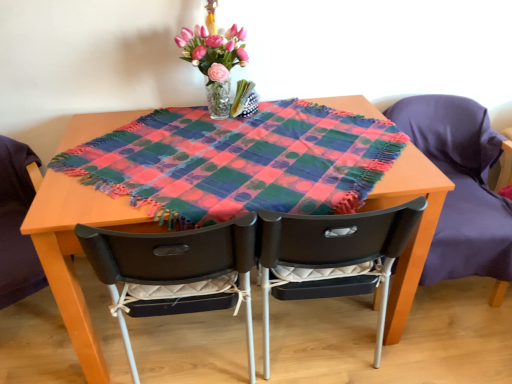
Question: Would you say matte black chair at center, the third chair viewed from the right, contains wooden table at center?

Choices:
 (A) no
 (B) yes

Answer: (A)

Question: Are matte black chair at center, the 1th chair viewed from the left, and wooden table at center beside each other?

Choices:
 (A) no
 (B) yes

Answer: (A)

Question: Considering the relative sizes of matte black chair at center, the 1th chair viewed from the left, and wooden table at center in the image provided, is matte black chair at center, the 1th chair viewed from the left, bigger than wooden table at center?

Choices:
 (A) yes
 (B) no

Answer: (A)

Question: Considering the relative positions of matte black chair at center, the third chair viewed from the right, and wooden table at center in the image provided, is matte black chair at center, the third chair viewed from the right, to the left of wooden table at center from the viewer's perspective?

Choices:
 (A) no
 (B) yes

Answer: (B)

Question: Is matte black chair at center, the third chair viewed from the right, taller than wooden table at center?

Choices:
 (A) no
 (B) yes

Answer: (B)

Question: Can you confirm if matte black chair at center, the 1th chair viewed from the left, is wider than wooden table at center?

Choices:
 (A) no
 (B) yes

Answer: (A)

Question: From the image's perspective, is matte black chair at right, which is the first chair from right to left, beneath matte black chair at center, the third chair viewed from the right?

Choices:
 (A) no
 (B) yes

Answer: (A)

Question: Is matte black chair at right, which is the 3th chair in left-to-right order, to the left of matte black chair at center, the 1th chair viewed from the left, from the viewer's perspective?

Choices:
 (A) yes
 (B) no

Answer: (B)

Question: Does matte black chair at right, which is the first chair from right to left, contain matte black chair at center, the 1th chair viewed from the left?

Choices:
 (A) yes
 (B) no

Answer: (B)

Question: Would you say matte black chair at right, which is the first chair from right to left, is outside matte black chair at center, the third chair viewed from the right?

Choices:
 (A) no
 (B) yes

Answer: (B)

Question: Does matte black chair at right, which is the 3th chair in left-to-right order, touch matte black chair at center, the 1th chair viewed from the left?

Choices:
 (A) no
 (B) yes

Answer: (A)

Question: Is matte black chair at right, which is the 3th chair in left-to-right order, taller than matte black chair at center, the 1th chair viewed from the left?

Choices:
 (A) no
 (B) yes

Answer: (A)

Question: Does black plastic chair at center, the second chair viewed from the left, lie in front of wooden table at center?

Choices:
 (A) yes
 (B) no

Answer: (B)